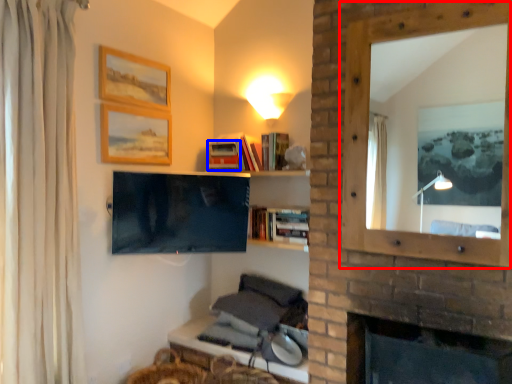
Question: Which object is closer to the camera taking this photo, window frame (highlighted by a red box) or book (highlighted by a blue box)?

Choices:
 (A) window frame
 (B) book

Answer: (A)